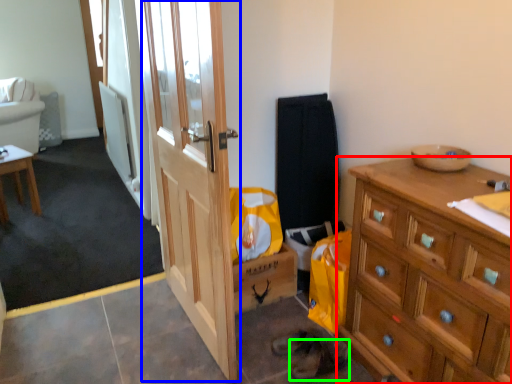
Question: Which object is the closest to the cabinetry (highlighted by a red box)? Choose among these: door (highlighted by a blue box) or shoe (highlighted by a green box).

Choices:
 (A) door
 (B) shoe

Answer: (B)